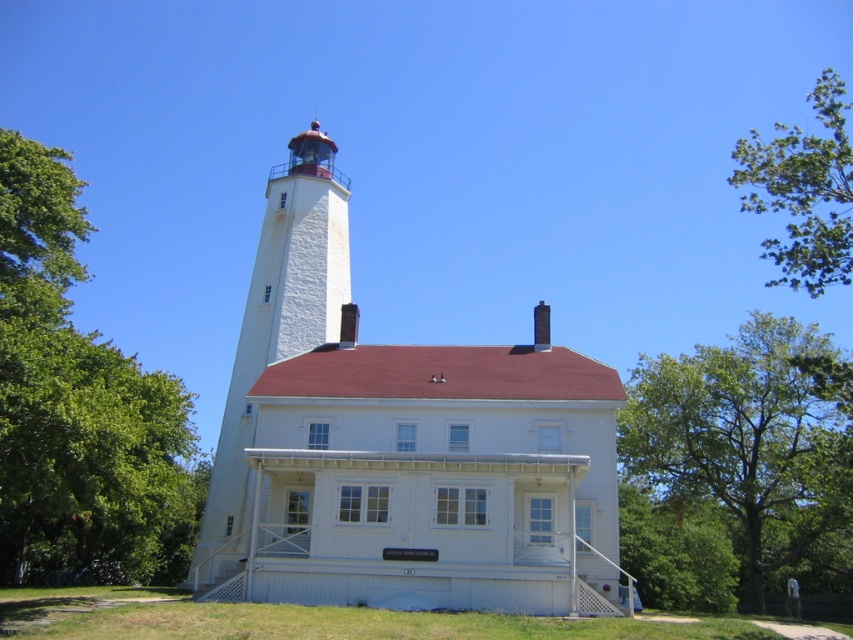
Does point (277, 346) come in front of point (4, 269)?

That is False.

Does white stucco tower at upper center have a lesser height compared to green leafy tree at left?

No.

Image resolution: width=853 pixels, height=640 pixels. Identify the location of white stucco tower at upper center. (399, 445).

Does green leafy tree at right appear on the left side of white stucco lighthouse at center?

Incorrect, green leafy tree at right is not on the left side of white stucco lighthouse at center.

Between point (666, 576) and point (314, 317), which one is positioned in front?

Positioned in front is point (314, 317).

Is point (729, 529) positioned behind point (271, 262)?

Yes.

At what (x,y) coordinates should I click in order to perform the action: click on green leafy tree at right. Please return your answer as a coordinate pair (x, y). Image resolution: width=853 pixels, height=640 pixels. Looking at the image, I should click on (740, 467).

Which is more to the right, green leafy tree at left or green leafy tree at upper right?

green leafy tree at upper right

Find the location of a particular element. The image size is (853, 640). green leafy tree at left is located at coordinates (79, 408).